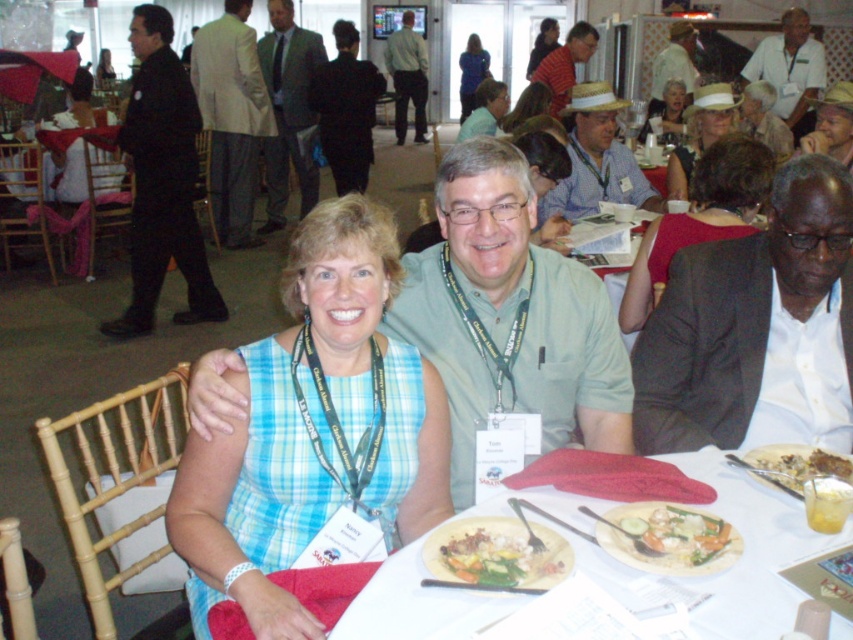
Question: Is black smooth suit at left smaller than white creamy mashed potatoes at lower right?

Choices:
 (A) yes
 (B) no

Answer: (B)

Question: Estimate the real-world distances between objects in this image. Which object is closer to the smooth skin woman at upper left?

Choices:
 (A) green leafy vegetables at center
 (B) white straw hat at upper center
 (C) light brown shirt at upper center

Answer: (C)

Question: Estimate the real-world distances between objects in this image. Which object is farther from the blue plaid dress at center?

Choices:
 (A) green lanyard at center
 (B) blue fabric dress at center

Answer: (B)

Question: Does white shirt at upper center appear over light brown shirt at upper center?

Choices:
 (A) yes
 (B) no

Answer: (B)

Question: Which of the following is the closest to the observer?

Choices:
 (A) matte black dress at upper center
 (B) smooth skin woman at upper left
 (C) green textured suit at center
 (D) blue plaid dress at center

Answer: (D)

Question: Observing the image, what is the correct spatial positioning of blue plaid dress at center in reference to light beige suit at upper left?

Choices:
 (A) below
 (B) above

Answer: (A)